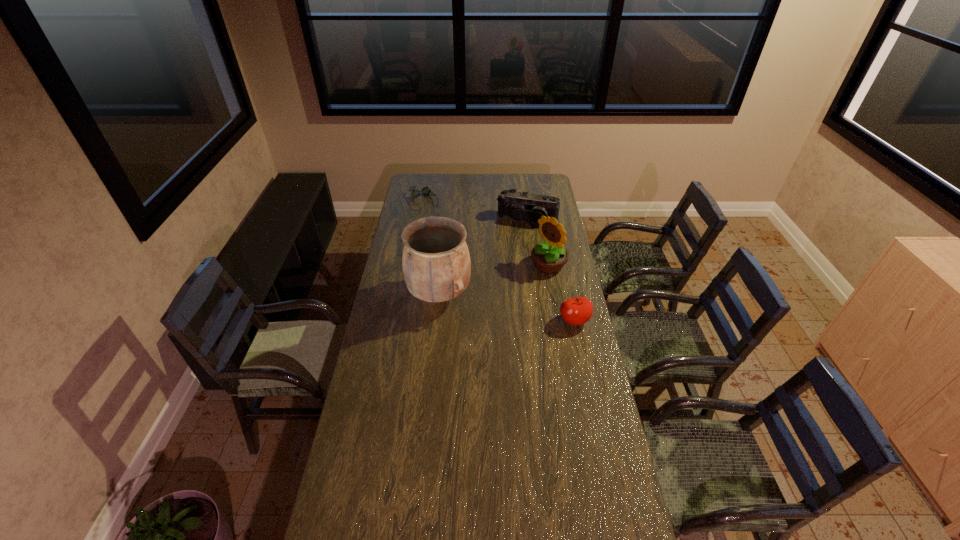
Where is `urn`? This screenshot has height=540, width=960. urn is located at coordinates (436, 262).

This screenshot has height=540, width=960. In order to click on the fourth tallest object in this screenshot , I will do 575,311.

Where is `camcorder`? The width and height of the screenshot is (960, 540). camcorder is located at coordinates (524, 206).

Locate an element on the screen. The height and width of the screenshot is (540, 960). sunflower is located at coordinates (549, 257).

Identify the location of spectacles. The width and height of the screenshot is (960, 540). (425, 191).

Locate an element on the screen. vacant region located 0.360m on the back of the urn is located at coordinates (445, 230).

The image size is (960, 540). What are the coordinates of `free point located on the back of the apple` in the screenshot? It's located at (566, 286).

I want to click on vacant point located on the front-facing side of the camcorder, so click(504, 268).

Locate an element on the screen. The image size is (960, 540). vacant space located 0.240m on the front-facing side of the camcorder is located at coordinates (510, 255).

At what (x,y) coordinates should I click in order to perform the action: click on vacant space situated 0.340m on the front-facing side of the camcorder. Please return your answer as a coordinate pair (x, y). This screenshot has height=540, width=960. Looking at the image, I should click on (505, 267).